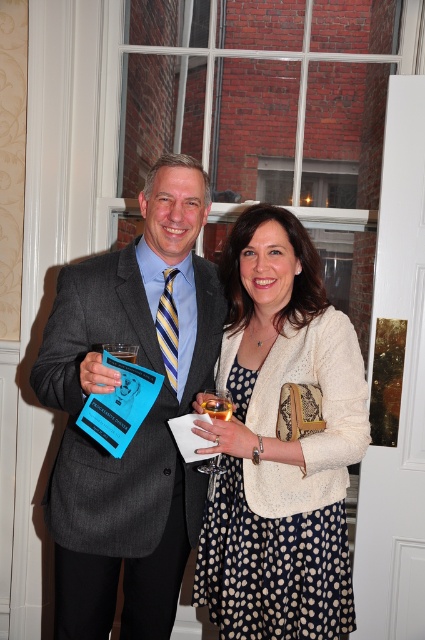
Question: Which object is positioned farthest from the clear glass wine glass at center?

Choices:
 (A) gray wool suit at center
 (B) white textured sweater at center

Answer: (A)

Question: Considering the real-world distances, which object is farthest from the white textured sweater at center?

Choices:
 (A) clear glass wine glass at center
 (B) gray wool suit at center

Answer: (B)

Question: Estimate the real-world distances between objects in this image. Which object is farther from the gray wool suit at center?

Choices:
 (A) white textured sweater at center
 (B) clear glass wine glass at center

Answer: (B)

Question: Is white textured sweater at center smaller than clear glass wine glass at center?

Choices:
 (A) no
 (B) yes

Answer: (A)

Question: From the image, what is the correct spatial relationship of gray wool suit at center in relation to white textured sweater at center?

Choices:
 (A) below
 (B) above

Answer: (A)

Question: Does gray wool suit at center lie in front of white textured sweater at center?

Choices:
 (A) yes
 (B) no

Answer: (A)